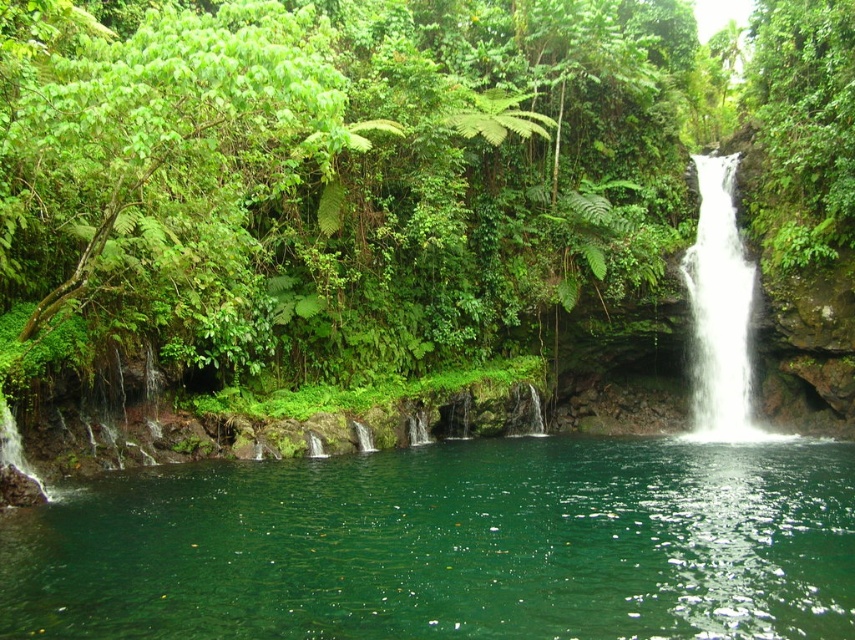
What do you see at coordinates (337, 177) in the screenshot? I see `green leafy foliage at upper center` at bounding box center [337, 177].

Is green leafy foliage at upper center thinner than green translucent water at center?

In fact, green leafy foliage at upper center might be wider than green translucent water at center.

Is point (652, 35) positioned before point (423, 488)?

No, (652, 35) is behind (423, 488).

Locate an element on the screen. This screenshot has width=855, height=640. green leafy foliage at upper center is located at coordinates (337, 177).

Which is above, green leafy foliage at upper center or white smooth waterfall at right?

green leafy foliage at upper center is higher up.

Does point (812, 269) lie in front of point (753, 284)?

Yes, it is in front of point (753, 284).

Which is behind, point (475, 330) or point (699, 243)?

Point (699, 243)

Where is `green leafy foliage at upper center`? Image resolution: width=855 pixels, height=640 pixels. green leafy foliage at upper center is located at coordinates (337, 177).

Between point (140, 522) and point (699, 404), which one is positioned in front?

Positioned in front is point (140, 522).

Who is more forward, (116,632) or (738,372)?

Positioned in front is point (116,632).

Find the location of a particular element. green translucent water at center is located at coordinates (450, 545).